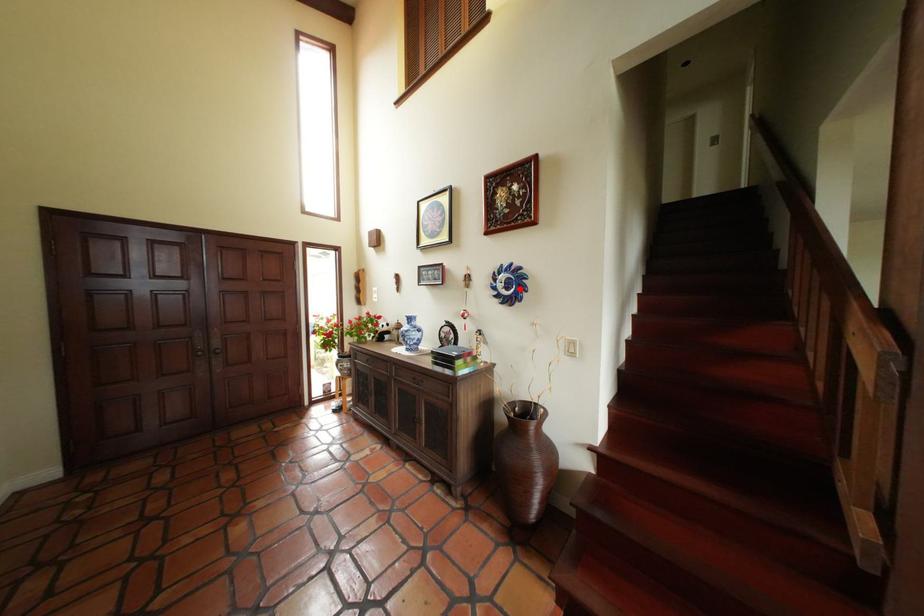
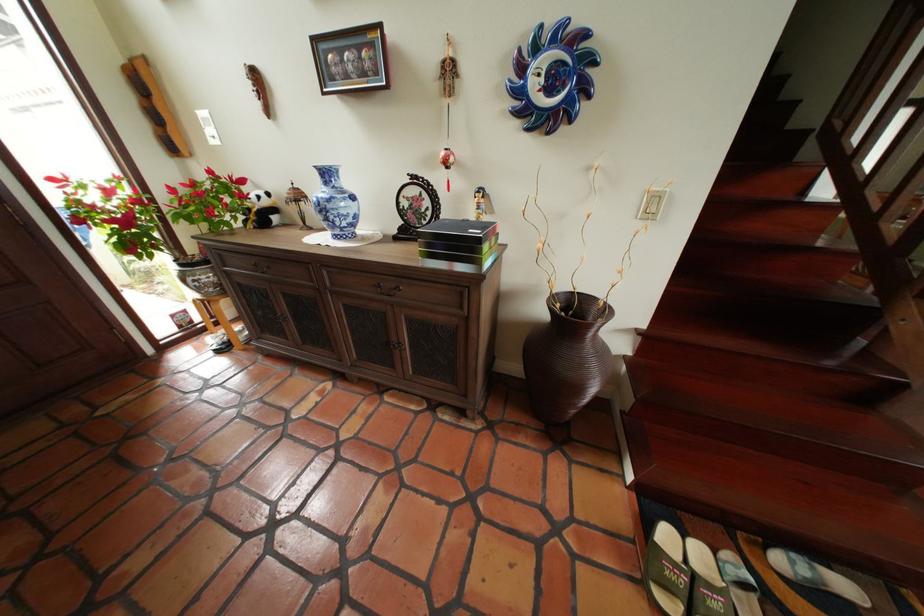
Question: I am providing you with two images of the same scene from different viewpoints. A red point is marked on the first image. At the location where the point appears in image 1, is it still visible in image 2?

Choices:
 (A) Yes
 (B) No

Answer: (A)